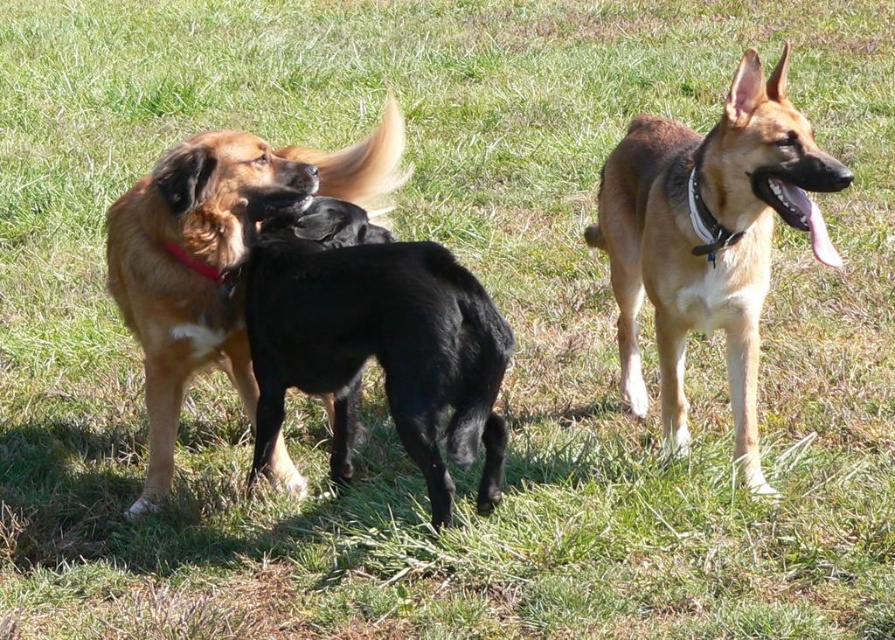
Question: Which of the following is the closest to the observer?

Choices:
 (A) brown fur dog at center
 (B) golden fur dog at center
 (C) black smooth dog at center

Answer: (B)

Question: Does golden fur dog at center appear over brown fur dog at center?

Choices:
 (A) yes
 (B) no

Answer: (A)

Question: Which point is closer to the camera taking this photo?

Choices:
 (A) (113, 252)
 (B) (738, 81)
 (C) (305, 240)

Answer: (B)

Question: Does golden fur dog at center appear on the right side of black smooth dog at center?

Choices:
 (A) yes
 (B) no

Answer: (A)

Question: Can you confirm if golden fur dog at center is positioned to the left of brown fur dog at center?

Choices:
 (A) no
 (B) yes

Answer: (A)

Question: Which object is the farthest from the black smooth dog at center?

Choices:
 (A) brown fur dog at center
 (B) golden fur dog at center

Answer: (B)